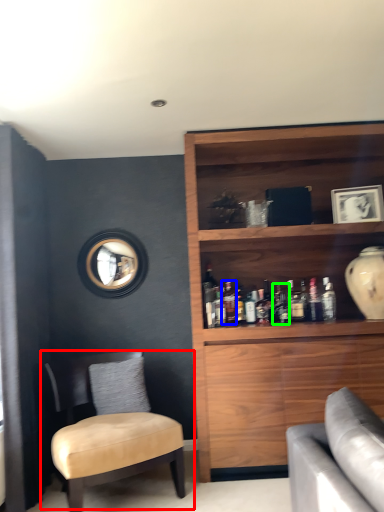
Question: Estimate the real-world distances between objects in this image. Which object is closer to chair (highlighted by a red box), bottle (highlighted by a blue box) or bottle (highlighted by a green box)?

Choices:
 (A) bottle
 (B) bottle

Answer: (A)